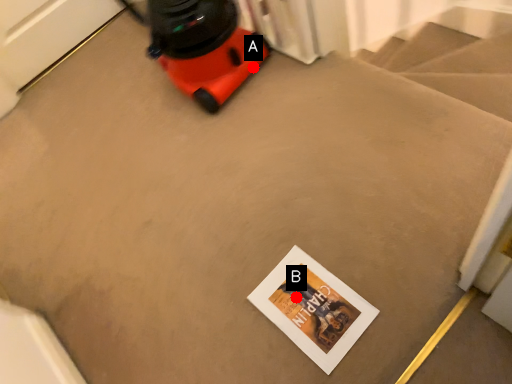
Question: Two points are circled on the image, labeled by A and B beside each circle. Which point is farther to the camera?

Choices:
 (A) A is further
 (B) B is further

Answer: (A)